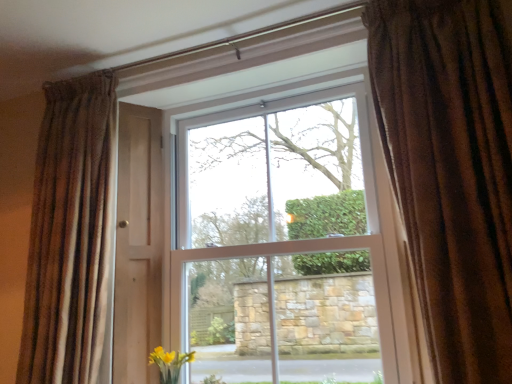
Question: Does brown textured curtain at right, the 1th curtain in the right-to-left sequence, have a smaller size compared to brown textured curtain at left, which is the 1th curtain in left-to-right order?

Choices:
 (A) yes
 (B) no

Answer: (B)

Question: Can you confirm if brown textured curtain at right, which ranks as the 1th curtain in front-to-back order, is thinner than brown textured curtain at left, which is counted as the first curtain, starting from the back?

Choices:
 (A) no
 (B) yes

Answer: (A)

Question: Can you confirm if brown textured curtain at right, the 1th curtain in the right-to-left sequence, is shorter than brown textured curtain at left, which is the 1th curtain in left-to-right order?

Choices:
 (A) no
 (B) yes

Answer: (B)

Question: Considering the relative positions of brown textured curtain at right, the 1th curtain in the right-to-left sequence, and brown textured curtain at left, marked as the second curtain in a front-to-back arrangement, in the image provided, is brown textured curtain at right, the 1th curtain in the right-to-left sequence, to the left of brown textured curtain at left, marked as the second curtain in a front-to-back arrangement, from the viewer's perspective?

Choices:
 (A) no
 (B) yes

Answer: (A)

Question: Is brown textured curtain at right, which ranks as the 1th curtain in front-to-back order, not near brown textured curtain at left, which appears as the 2th curtain when viewed from the right?

Choices:
 (A) yes
 (B) no

Answer: (A)

Question: Considering the relative sizes of brown textured curtain at right, the 1th curtain in the right-to-left sequence, and brown textured curtain at left, marked as the second curtain in a front-to-back arrangement, in the image provided, is brown textured curtain at right, the 1th curtain in the right-to-left sequence, wider than brown textured curtain at left, marked as the second curtain in a front-to-back arrangement,?

Choices:
 (A) yes
 (B) no

Answer: (A)

Question: Does white plastic window at center appear on the right side of brown textured curtain at left, which is counted as the first curtain, starting from the back?

Choices:
 (A) yes
 (B) no

Answer: (A)

Question: Can you confirm if white plastic window at center is bigger than brown textured curtain at left, marked as the second curtain in a front-to-back arrangement?

Choices:
 (A) yes
 (B) no

Answer: (A)

Question: Does white plastic window at center have a greater height compared to brown textured curtain at left, which appears as the 2th curtain when viewed from the right?

Choices:
 (A) no
 (B) yes

Answer: (B)

Question: Would you say white plastic window at center is outside brown textured curtain at left, which appears as the 2th curtain when viewed from the right?

Choices:
 (A) no
 (B) yes

Answer: (B)

Question: Does white plastic window at center contain brown textured curtain at left, marked as the second curtain in a front-to-back arrangement?

Choices:
 (A) no
 (B) yes

Answer: (A)

Question: Does white plastic window at center touch brown textured curtain at left, which appears as the 2th curtain when viewed from the right?

Choices:
 (A) yes
 (B) no

Answer: (B)

Question: Is brown textured curtain at left, which appears as the 2th curtain when viewed from the right, looking in the opposite direction of white plastic window at center?

Choices:
 (A) no
 (B) yes

Answer: (A)